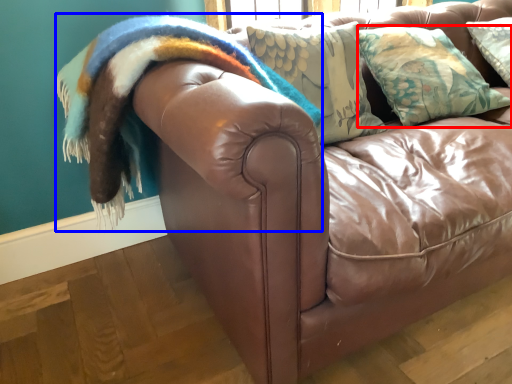
Question: Which object is further to the camera taking this photo, pillow (highlighted by a red box) or blanket (highlighted by a blue box)?

Choices:
 (A) pillow
 (B) blanket

Answer: (A)